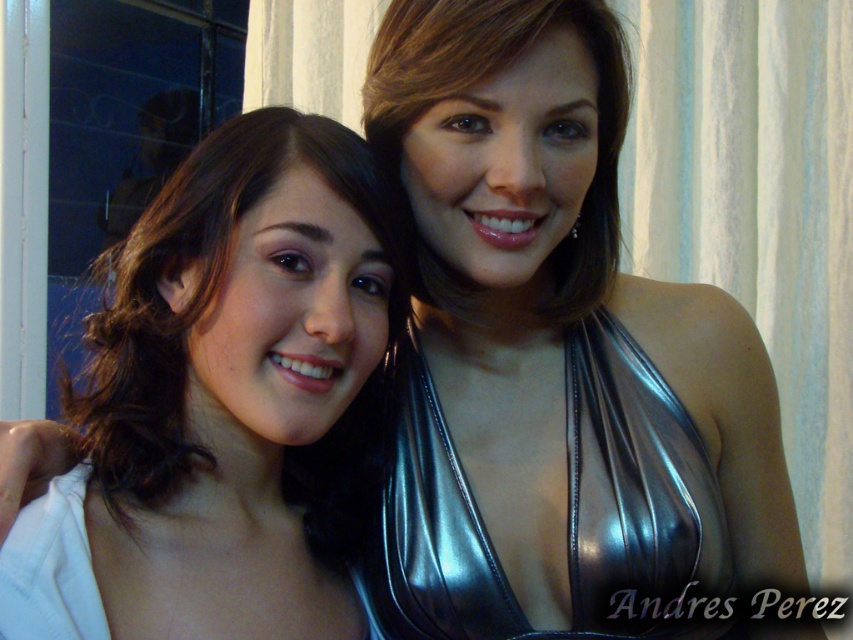
Question: Where is matte black hair at center located in relation to shiny black dress at center in the image?

Choices:
 (A) above
 (B) below

Answer: (A)

Question: Which of the following is the farthest from the observer?

Choices:
 (A) matte black hair at center
 (B) shiny black dress at center

Answer: (B)

Question: Can you confirm if matte black hair at center is wider than shiny black dress at center?

Choices:
 (A) no
 (B) yes

Answer: (A)

Question: Is the position of matte black hair at center more distant than that of shiny black dress at center?

Choices:
 (A) yes
 (B) no

Answer: (B)